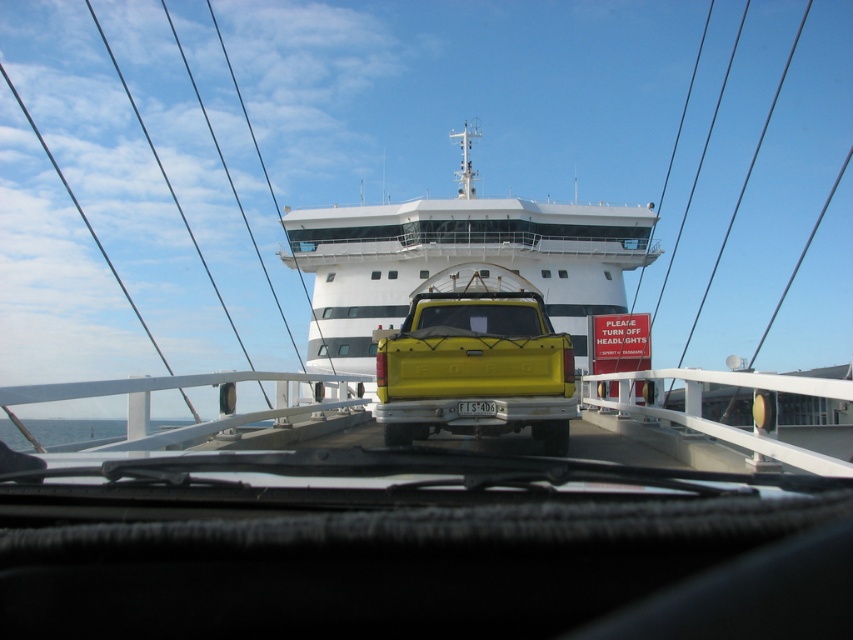
Question: Based on their relative distances, which object is nearer to the yellow matte truck at center?

Choices:
 (A) transparent glass windshield at center
 (B) white glossy cruise ship at upper center

Answer: (A)

Question: Which point is farther to the camera?

Choices:
 (A) transparent glass windshield at center
 (B) white glossy cruise ship at upper center
 (C) white plastic license plate at center

Answer: (B)

Question: Which of the following is the closest to the observer?

Choices:
 (A) white plastic license plate at center
 (B) transparent glass windshield at center

Answer: (A)

Question: Is white glossy cruise ship at upper center bigger than transparent glass windshield at center?

Choices:
 (A) yes
 (B) no

Answer: (A)

Question: Does white glossy cruise ship at upper center have a larger size compared to yellow matte truck at center?

Choices:
 (A) no
 (B) yes

Answer: (B)

Question: Does yellow matte truck at center have a lesser width compared to white plastic license plate at center?

Choices:
 (A) no
 (B) yes

Answer: (A)